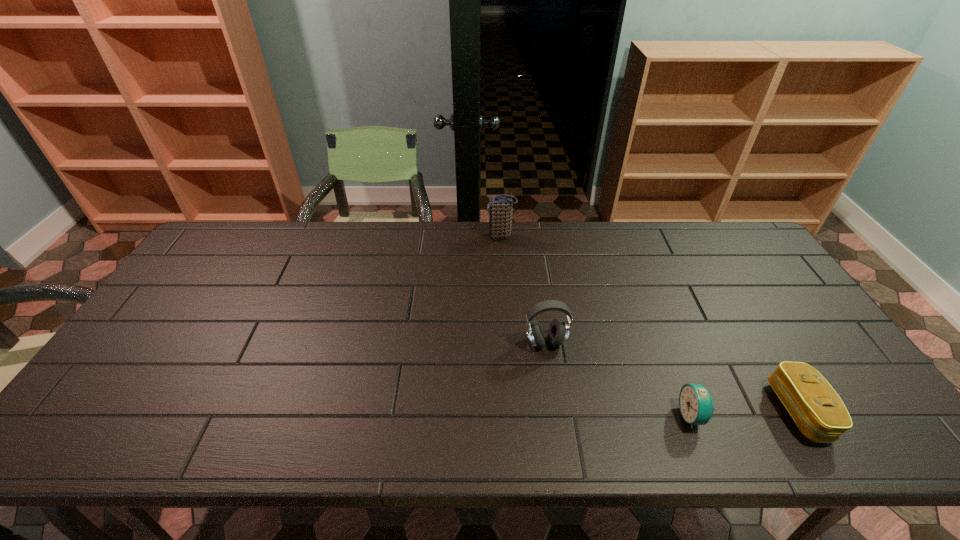
Locate an element on the screen. This screenshot has width=960, height=540. the left clutch bag is located at coordinates (500, 207).

Image resolution: width=960 pixels, height=540 pixels. What are the coordinates of `the farthest object` in the screenshot? It's located at (500, 207).

Find the location of a particular element. The width and height of the screenshot is (960, 540). the third nearest object is located at coordinates (558, 332).

Where is `alarm clock`? The image size is (960, 540). alarm clock is located at coordinates (696, 405).

Locate an element on the screen. the shorter clutch bag is located at coordinates (818, 411).

Locate an element on the screen. Image resolution: width=960 pixels, height=540 pixels. the nearer clutch bag is located at coordinates (818, 411).

Where is `vacant area situated 0.230m with the zip open on the left clutch bag`? The height and width of the screenshot is (540, 960). vacant area situated 0.230m with the zip open on the left clutch bag is located at coordinates (420, 236).

Where is `vacant space located with the zip open on the left clutch bag`? The image size is (960, 540). vacant space located with the zip open on the left clutch bag is located at coordinates (379, 236).

Identify the location of free point located with the zip open on the left clutch bag. point(434,236).

You are a GUI agent. You are given a task and a screenshot of the screen. Output one action in this format:
    pyautogui.click(x=<x>, y=<y>)
    Task: Click on the vacant space located 0.080m on the ear cups of the second farthest object
    Image resolution: width=960 pixels, height=540 pixels.
    Given the screenshot: What is the action you would take?
    pyautogui.click(x=551, y=380)